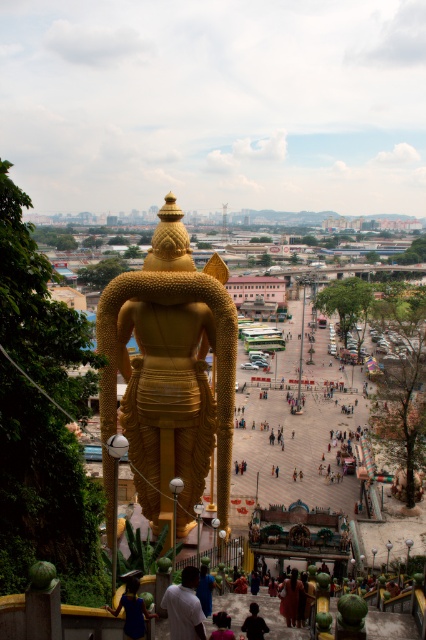
Is matte red dress at center closer to the viewer compared to dark fabric shirt at center?

No.

Does matte red dress at center have a lesser height compared to dark fabric shirt at center?

No.

The image size is (426, 640). Find the location of `matte red dress at center`. matte red dress at center is located at coordinates (290, 596).

Find the location of a particular element. This screenshot has height=640, width=426. matte red dress at center is located at coordinates (290, 596).

Is white matte shirt at center to the left of dark purple fabric at lower center from the viewer's perspective?

Correct, you'll find white matte shirt at center to the left of dark purple fabric at lower center.

Can you confirm if white matte shirt at center is shorter than dark purple fabric at lower center?

In fact, white matte shirt at center may be taller than dark purple fabric at lower center.

Between point (192, 584) and point (212, 637), which one is positioned behind?

Positioned behind is point (212, 637).

You are a GUI agent. You are given a task and a screenshot of the screen. Output one action in this format:
    pyautogui.click(x=<x>, y=<y>)
    Task: Click on the white matte shirt at center
    Image resolution: width=426 pixels, height=640 pixels.
    Given the screenshot: What is the action you would take?
    pyautogui.click(x=184, y=608)

Based on the photo, who is more distant from viewer, [192,584] or [112,609]?

The point [192,584] is behind.

Between white matte shirt at center and blue fabric dress at lower center, which one is positioned higher?

white matte shirt at center is higher up.

Does point (172, 588) come behind point (126, 602)?

Yes, it is.

Locate an element on the screen. Image resolution: width=426 pixels, height=640 pixels. white matte shirt at center is located at coordinates [x=184, y=608].